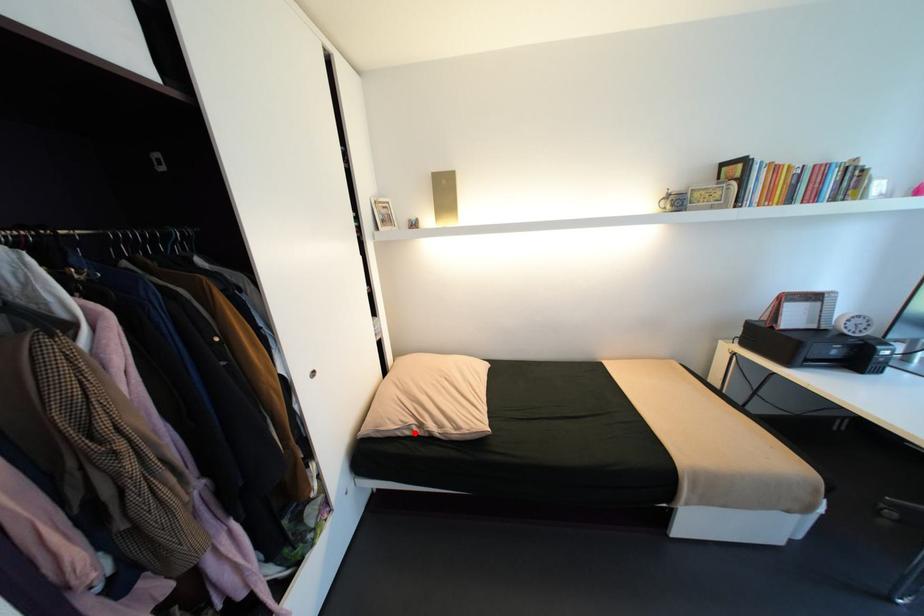
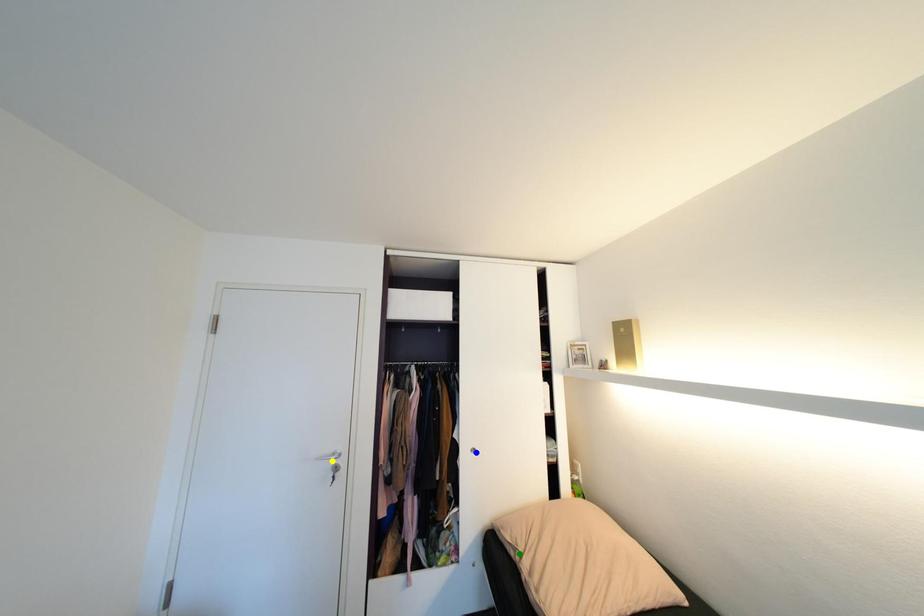
Question: I am providing you with two images of the same scene from different viewpoints. A red point is marked on the first image. You are given multiple points on the second image. Which point in image 2 is actually the same real-world point as the red point in image 1?

Choices:
 (A) blue point
 (B) green point
 (C) yellow point

Answer: (B)